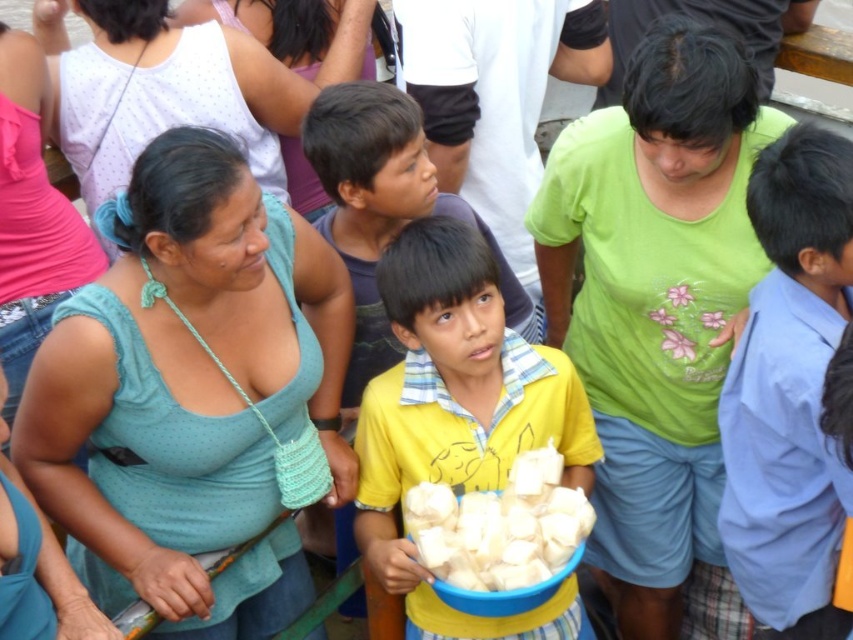
Consider the image. Who is positioned more to the right, teal fabric shirt at center or white soft bread at center?

Positioned to the right is white soft bread at center.

Is teal fabric shirt at center thinner than white soft bread at center?

Incorrect, teal fabric shirt at center's width is not less than white soft bread at center's.

Does point (32, 416) come in front of point (560, 461)?

Yes, point (32, 416) is in front of point (560, 461).

Locate an element on the screen. The image size is (853, 640). teal fabric shirt at center is located at coordinates (187, 381).

Can you confirm if teal fabric shirt at center is positioned below yellow matte shirt at center?

Correct, teal fabric shirt at center is located below yellow matte shirt at center.

Is point (329, 420) more distant than point (525, 336)?

No, (329, 420) is in front of (525, 336).

At what (x,y) coordinates should I click in order to perform the action: click on teal fabric shirt at center. Please return your answer as a coordinate pair (x, y). Image resolution: width=853 pixels, height=640 pixels. Looking at the image, I should click on (187, 381).

Is light blue cotton shirt at right to the left of white soft bread at center from the viewer's perspective?

No, light blue cotton shirt at right is not to the left of white soft bread at center.

Who is shorter, light blue cotton shirt at right or white soft bread at center?

white soft bread at center

The width and height of the screenshot is (853, 640). Find the location of `light blue cotton shirt at right`. light blue cotton shirt at right is located at coordinates (792, 392).